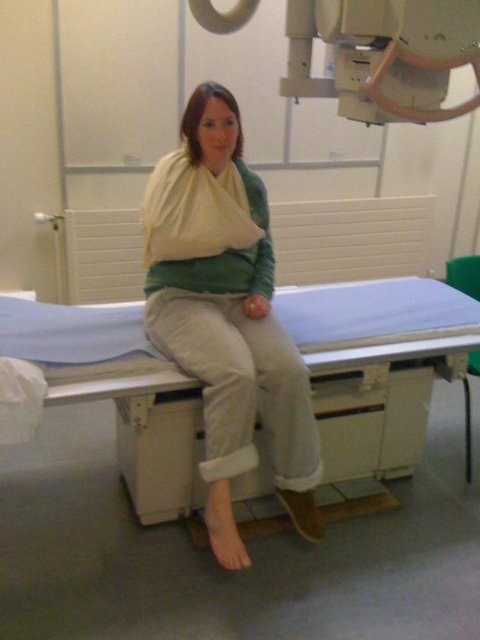
You are a medical technician in the xray room. You need to place a sensor at point A and point B. The coordinates are point A at point A is point (x=456, y=326) and point B is point (x=213, y=506). Which point is closer to the camera?

Point B is closer to the camera than point A because the description states that point A is further away than point B.

You are a nurse entering the xray room and see the blue fabric hospital bed at center and the matte white arm sling at center. Which object is closer to the door on the left side of the room?

The matte white arm sling at center is closer to the door on the left side of the room because the blue fabric hospital bed at center is to the right of it, placing the sling nearer to the door.

You are a healthcare assistant who needs to move a medical chart from the blue fabric hospital bed at center to the matte white arm sling at center. Given that the chart is 12 inches long, will it be long enough to reach between the two items?

The blue fabric hospital bed at center and matte white arm sling at center are 13.22 inches apart. Since the chart is only 12 inches long, it will not be long enough to span the distance between them.